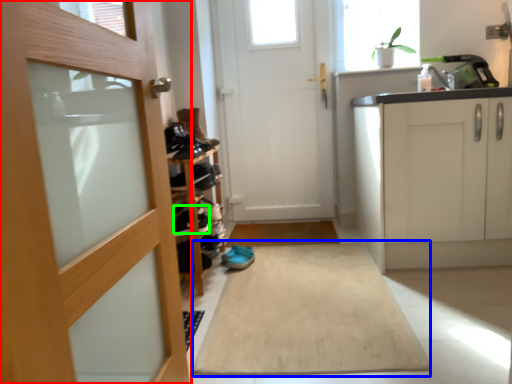
Question: Estimate the real-world distances between objects in this image. Which object is closer to door (highlighted by a red box), bath mat (highlighted by a blue box) or shoe (highlighted by a green box)?

Choices:
 (A) bath mat
 (B) shoe

Answer: (A)